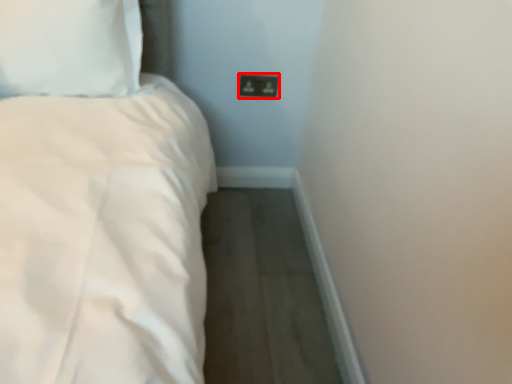
Question: From the image's perspective, where is socket (annotated by the red box) located relative to pillow?

Choices:
 (A) above
 (B) below

Answer: (B)